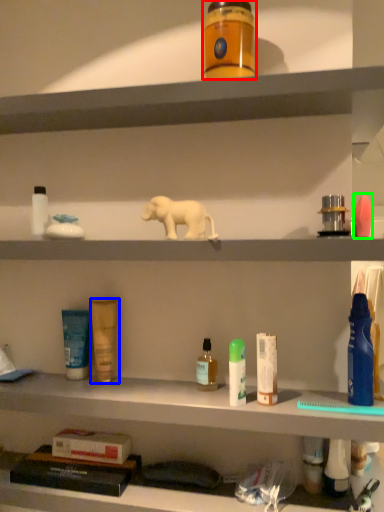
Question: Considering the real-world distances, which object is closest to toiletry (highlighted by a red box)? toiletry (highlighted by a blue box) or toiletry (highlighted by a green box).

Choices:
 (A) toiletry
 (B) toiletry

Answer: (B)